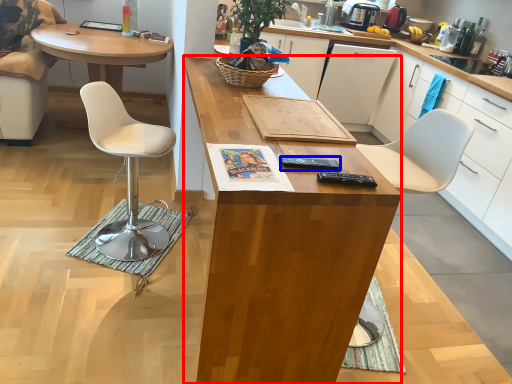
Question: Which object appears closest to the camera in this image, desk (highlighted by a red box) or remote control (highlighted by a blue box)?

Choices:
 (A) desk
 (B) remote control

Answer: (A)